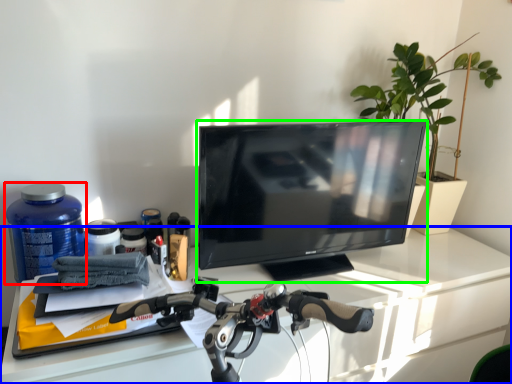
Question: Which object is the farthest from bottle (highlighted by a red box)? Choose among these: desk (highlighted by a blue box) or television (highlighted by a green box).

Choices:
 (A) desk
 (B) television

Answer: (B)